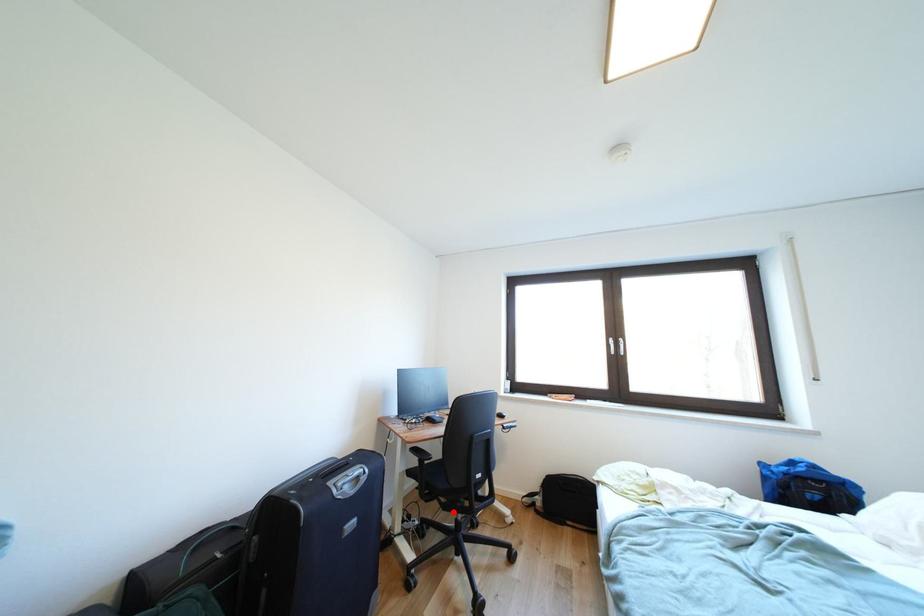
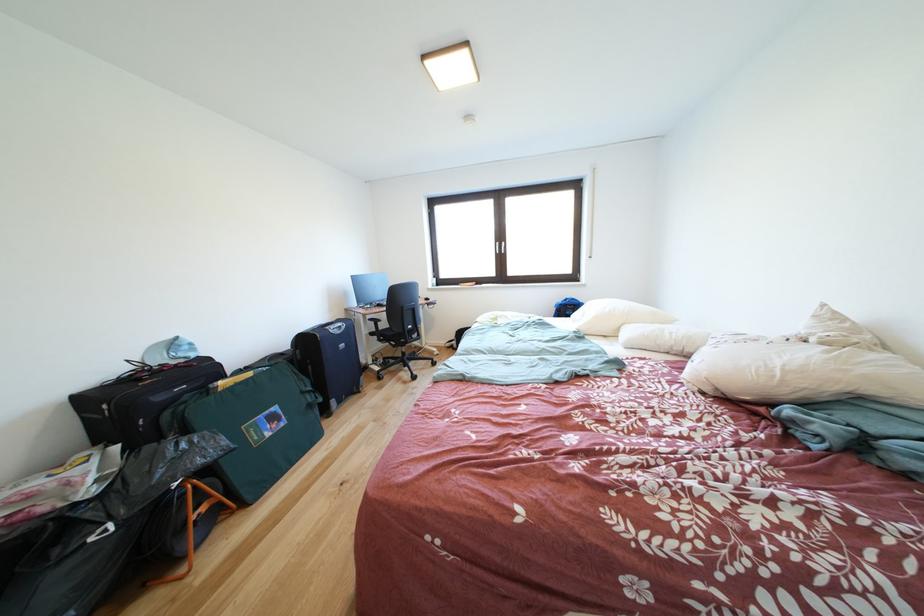
Where in the second image is the point corresponding to the highlighted location from the first image?

(403, 351)